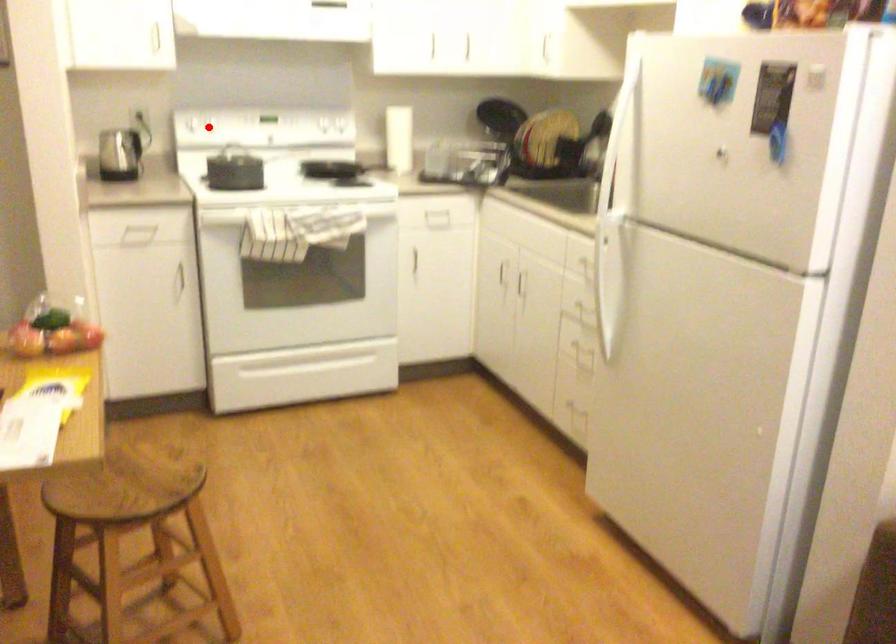
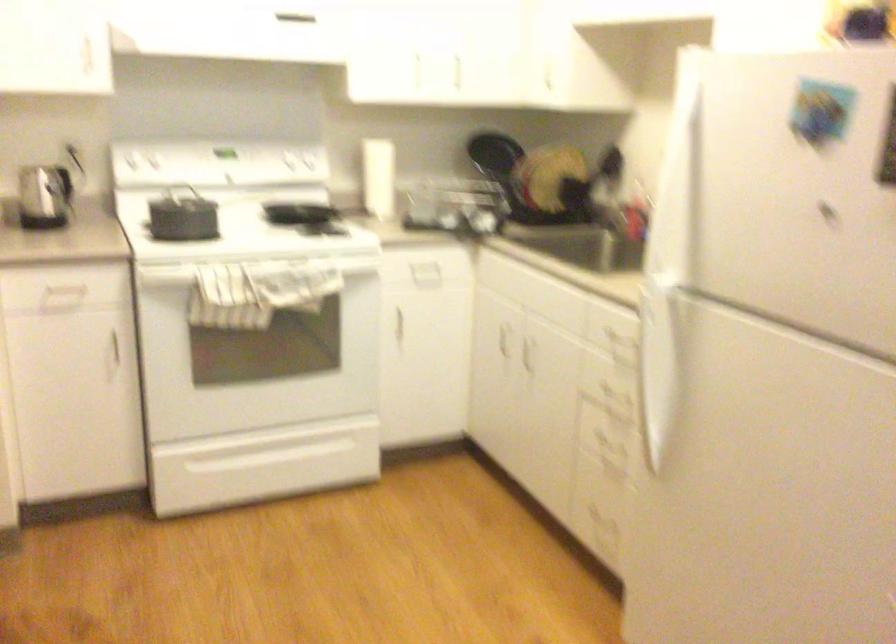
Question: A red point is marked in image1. In image2, is the corresponding 3D point closer to the camera or farther? Reply with the corresponding letter.

Choices:
 (A) The corresponding 3D point is closer.
 (B) The corresponding 3D point is farther.

Answer: (A)